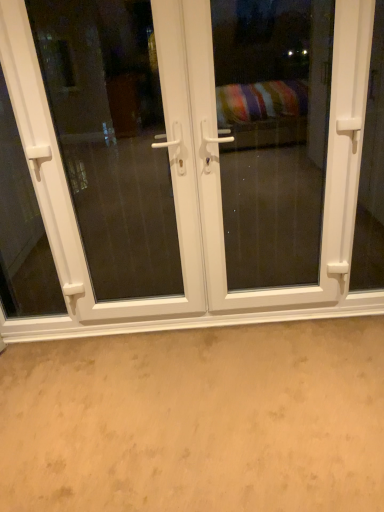
The width and height of the screenshot is (384, 512). In order to click on vacant space in white plastic screen door at center, which appears as the first screen door when viewed from the right (from a real-world perspective) in this screenshot , I will do `click(259, 314)`.